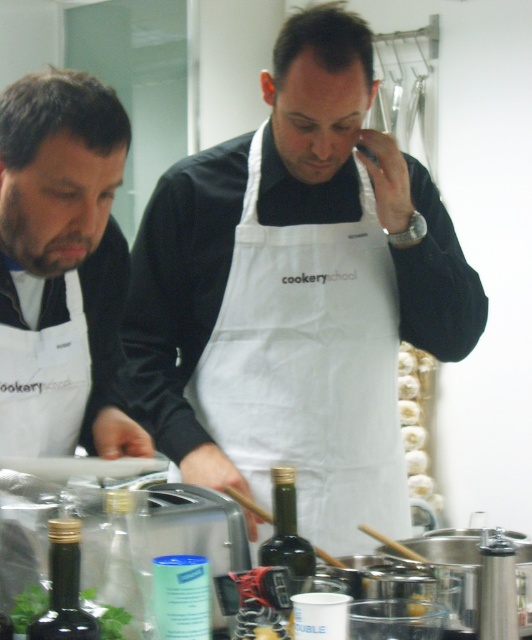
Question: Among these objects, which one is farthest from the camera?

Choices:
 (A) white glossy doughnuts at right
 (B) matte white apron at left

Answer: (A)

Question: Considering the real-world distances, which object is closest to the matte white apron at left?

Choices:
 (A) dark green glass bottle at lower left
 (B) white glossy doughnuts at right
 (C) white cotton apron at center
 (D) green glass bottle at center

Answer: (A)

Question: Observing the image, what is the correct spatial positioning of white glossy doughnuts at right in reference to green glass bottle at center?

Choices:
 (A) below
 (B) above

Answer: (A)

Question: Which of the following is the closest to the observer?

Choices:
 (A) dark green glass bottle at lower left
 (B) matte white apron at left
 (C) white glossy doughnuts at right
 (D) white cotton apron at center

Answer: (A)

Question: Is white fabric apron at left wider than green glass bottle at center?

Choices:
 (A) no
 (B) yes

Answer: (B)

Question: Is matte white apron at left wider than white fabric apron at left?

Choices:
 (A) yes
 (B) no

Answer: (A)